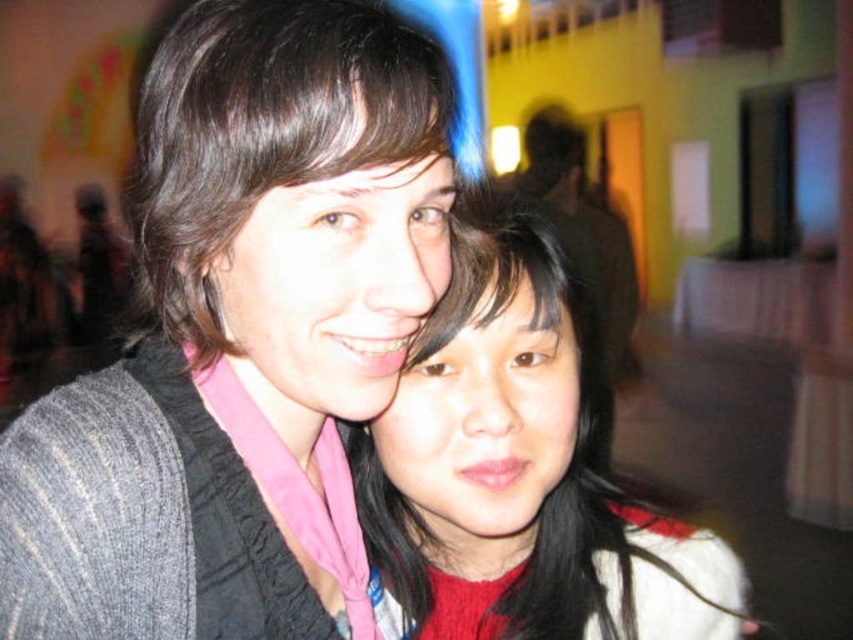
Question: Which of these objects is positioned farthest from the gray knitted sweater at upper left?

Choices:
 (A) smooth black hair at center
 (B) matte black hair at upper left

Answer: (A)

Question: Can you confirm if gray knitted sweater at upper left is bigger than matte black hair at upper left?

Choices:
 (A) yes
 (B) no

Answer: (B)

Question: Can you confirm if gray knitted sweater at upper left is positioned above matte black hair at upper left?

Choices:
 (A) no
 (B) yes

Answer: (A)

Question: Where is smooth black hair at center located in relation to matte black hair at upper left in the image?

Choices:
 (A) left
 (B) right

Answer: (B)

Question: Which of the following is the closest to the observer?

Choices:
 (A) gray knitted sweater at upper left
 (B) matte black hair at upper left
 (C) smooth black hair at center

Answer: (A)

Question: Which point is farther to the camera?

Choices:
 (A) coord(508,256)
 (B) coord(178,195)

Answer: (A)